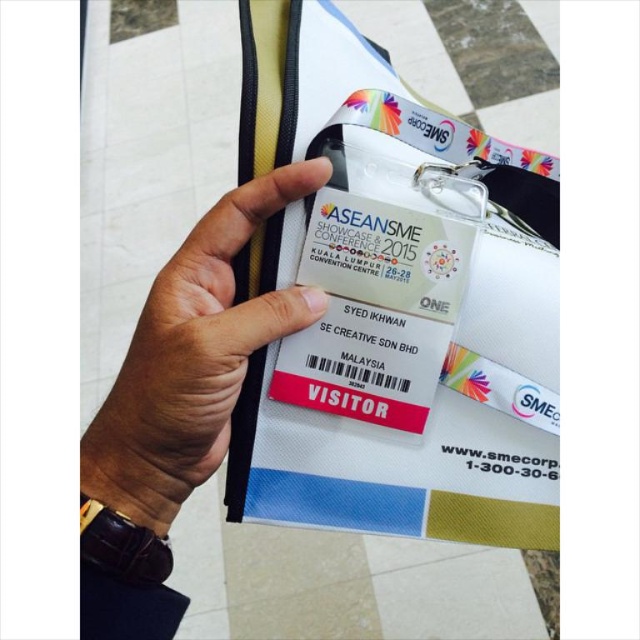
What are the coordinates of the white fabric badge at center in the image?

The white fabric badge at center is located at point (390,307).

You are a photographer who needs to capture a clear photo of the ASEAN SME Showcase Conference 2015 badge. The photographer notices both the white fabric badge at center and the brown leather wristwatch at center. Which object is positioned to the right side of the other?

The white fabric badge at center is to the right of the brown leather wristwatch at center.

You are a security guard checking badges at the ASEAN SME Showcase Conference 2015. You notice a participant whose hand has both a white fabric badge at center and a brown leather wristwatch at center. Which object is taller?

The white fabric badge at center is much taller than the brown leather wristwatch at center.